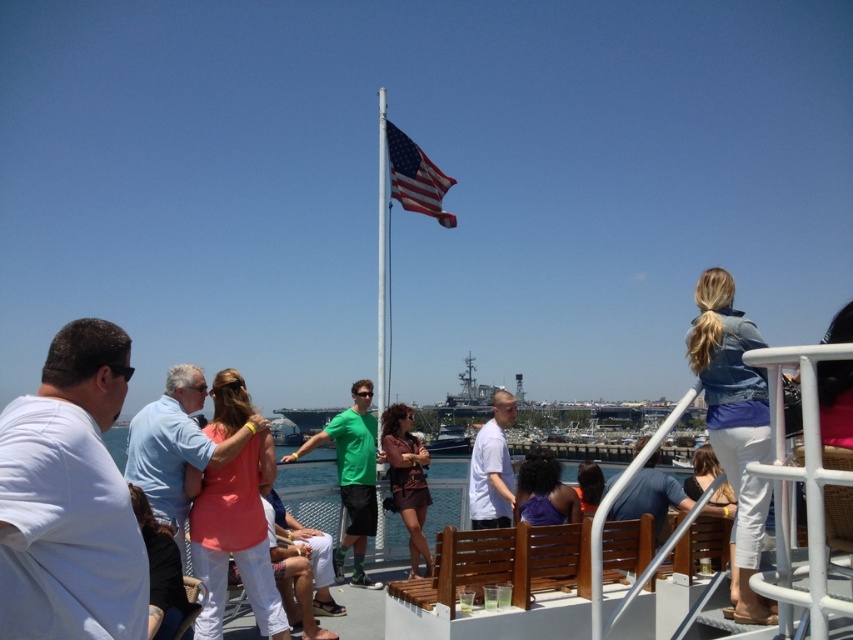
From the picture: You are standing on the deck and want to take a photo of the green matte shirt at center without the silver metallic flag pole at center blocking the view. Is this possible?

The green matte shirt at center is positioned under the silver metallic flag pole at center, so if you position yourself below the flag pole, you can take the photo without the flag pole blocking the view.

You are standing at the origin point of the coordinate system in the image. You want to find the green matte shirt at center. Which direction should you move to locate it?

The green matte shirt at center is located at coordinate point (352, 477), so you should move to the right and slightly forward to reach its position.

You are a photographer trying to capture both the green matte shirt at center and the silver metallic flag pole at center in the same frame. Which object would appear larger in your photo?

The silver metallic flag pole at center would appear larger in the photo because it is bigger than the green matte shirt at center.